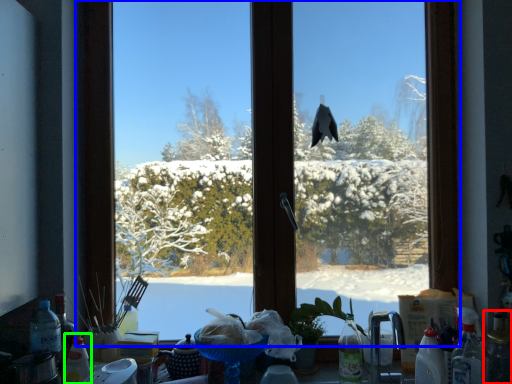
Question: Which object is the farthest from bottle (highlighted by a red box)? Choose among these: window (highlighted by a blue box) or bottle (highlighted by a green box).

Choices:
 (A) window
 (B) bottle

Answer: (B)